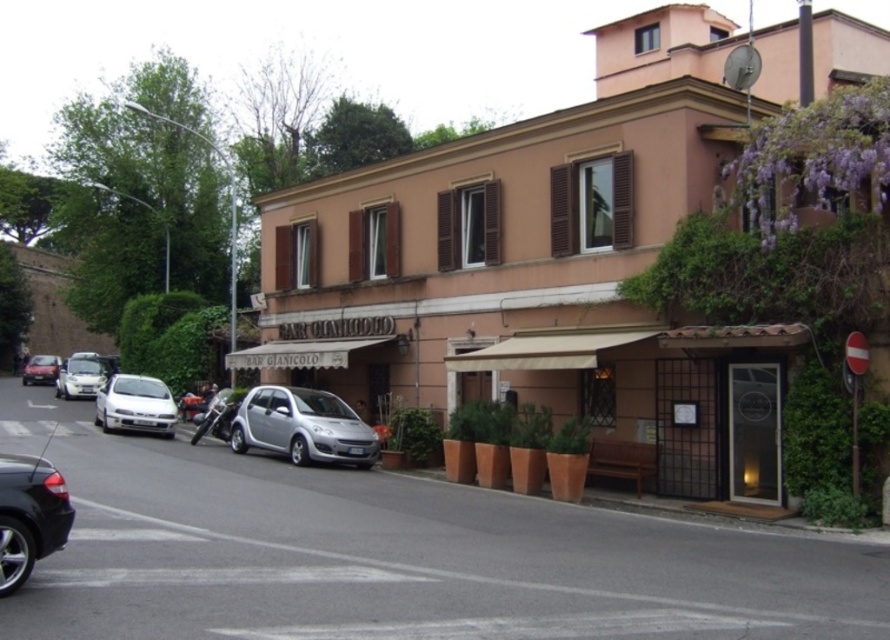
Can you confirm if silver metallic car at center is shorter than white matte car at center-left?

No, silver metallic car at center is not shorter than white matte car at center-left.

Does point (287, 410) come closer to viewer compared to point (158, 394)?

Yes, point (287, 410) is in front of point (158, 394).

Where is `silver metallic car at center`? silver metallic car at center is located at coordinates (302, 426).

Which is above, white matte car at center-left or matte silver car at left?

matte silver car at left

Does white matte car at center-left appear on the left side of matte silver car at left?

In fact, white matte car at center-left is to the right of matte silver car at left.

Does point (108, 420) come closer to viewer compared to point (50, 376)?

Yes, it is.

Find the location of a particular element. This screenshot has width=890, height=640. white matte car at center-left is located at coordinates (135, 404).

Based on the photo, can you confirm if silver metallic car at left is wider than matte silver car at left?

Yes, silver metallic car at left is wider than matte silver car at left.

Which is below, silver metallic car at left or matte silver car at left?

matte silver car at left is lower down.

What do you see at coordinates (81, 376) in the screenshot? The image size is (890, 640). I see `silver metallic car at left` at bounding box center [81, 376].

This screenshot has height=640, width=890. What are the coordinates of `silver metallic car at left` in the screenshot? It's located at click(81, 376).